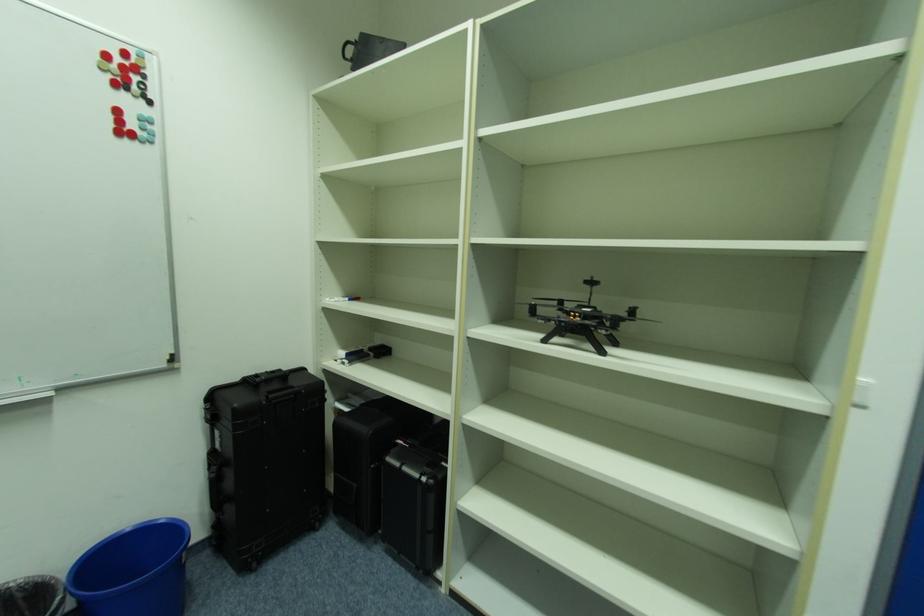
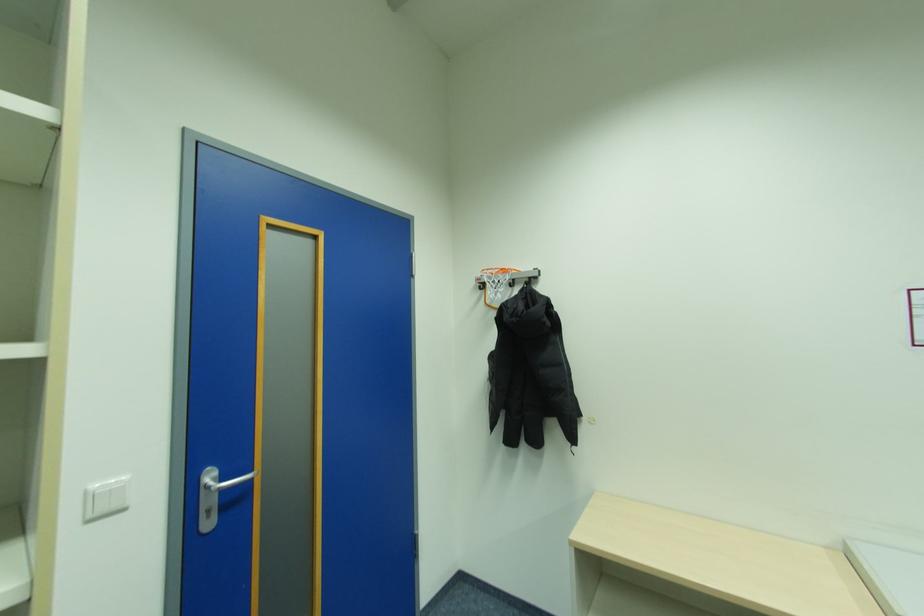
Question: The first image is from the beginning of the video and the second image is from the end. How did the camera likely rotate when shooting the video?

Choices:
 (A) Left
 (B) Right
 (C) Up
 (D) Down

Answer: (B)